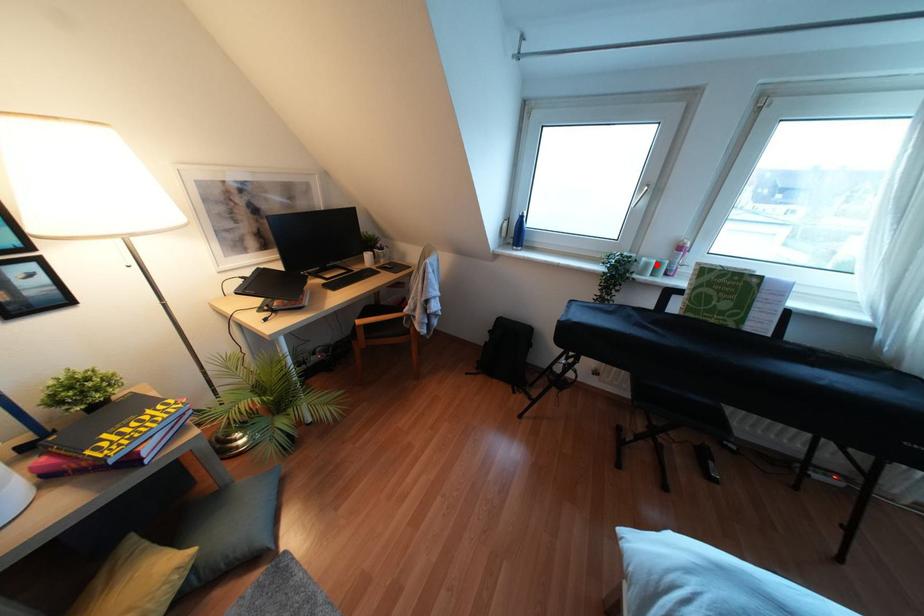
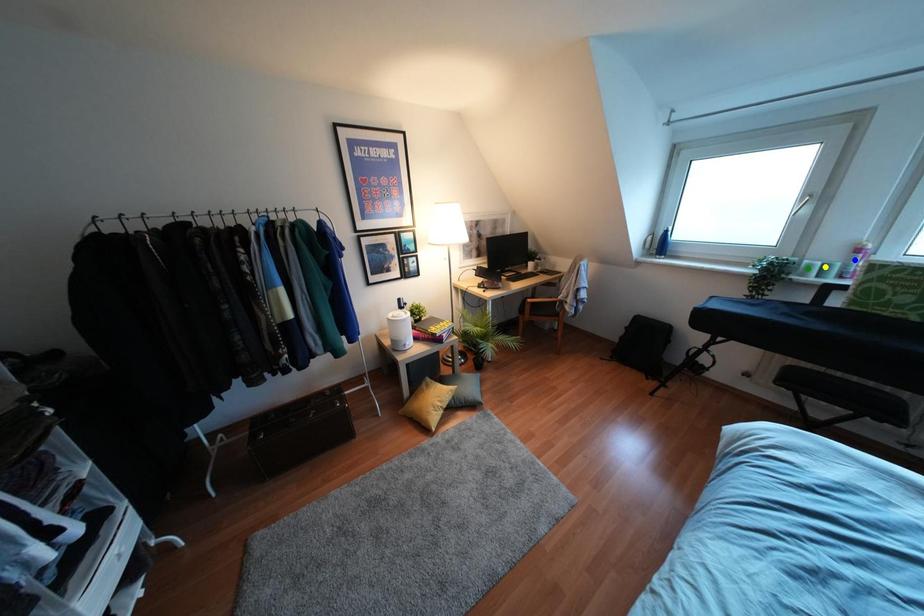
Question: I am providing you with two images of the same scene from different viewpoints. A red point is marked on the first image. You are given multiple points on the second image. Can you choose the point in image 2 that corresponds to the point in image 1?

Choices:
 (A) green point
 (B) yellow point
 (C) blue point

Answer: (B)